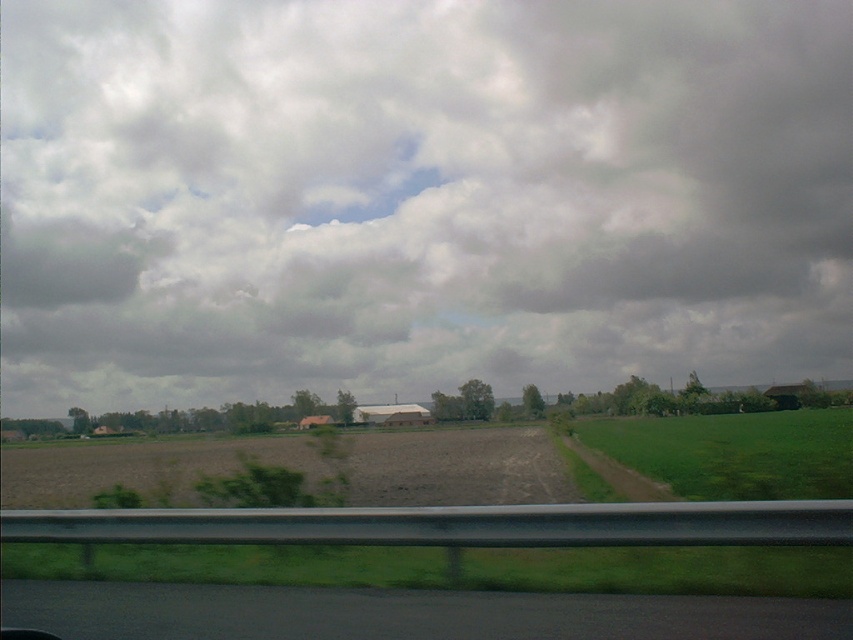
You are driving a car and see the black asphalt road at lower left and the green grassy field at right. Which object is nearer to you?

The black asphalt road at lower left is closer to the viewer than the green grassy field at right.

You are a passenger in a car driving along a rural road. You notice the cloudy sky at upper center and the green grassy field at right through the window. Which object is positioned to the left of the other?

The cloudy sky at upper center is positioned to the left of the green grassy field at right.